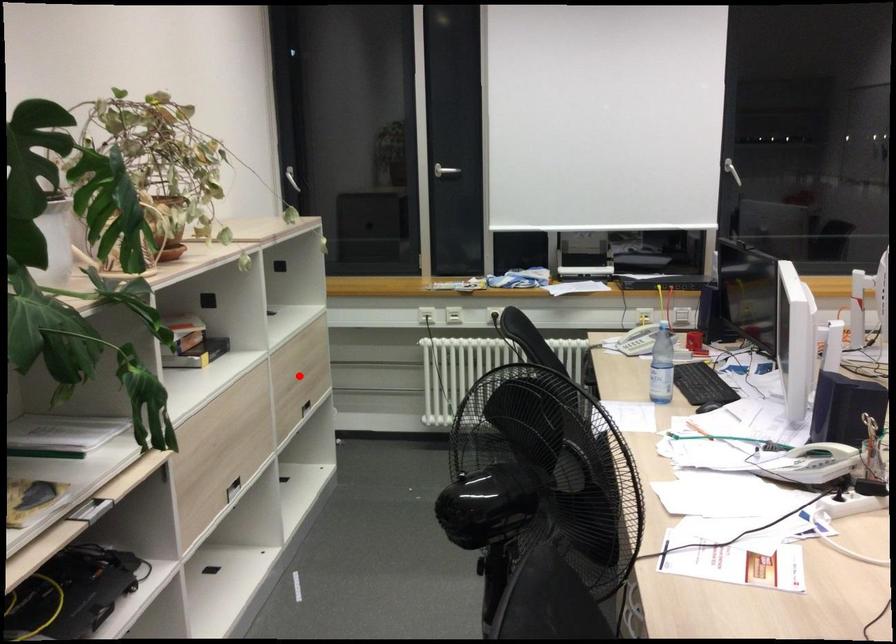
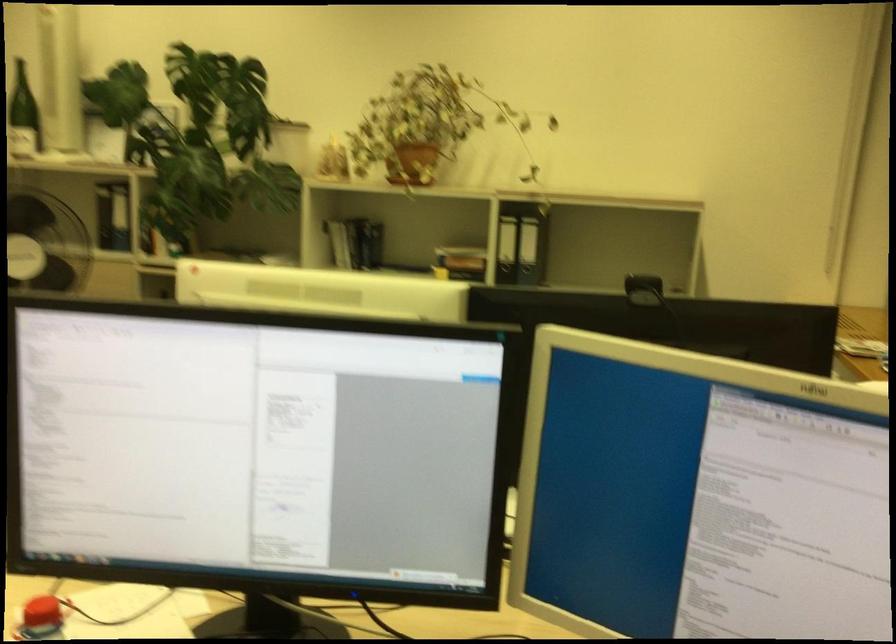
Question: I am providing you with two images of the same scene from different viewpoints. A red point is marked on the first image. Is the red point's position out of view in image 2?

Choices:
 (A) Yes
 (B) No

Answer: (A)